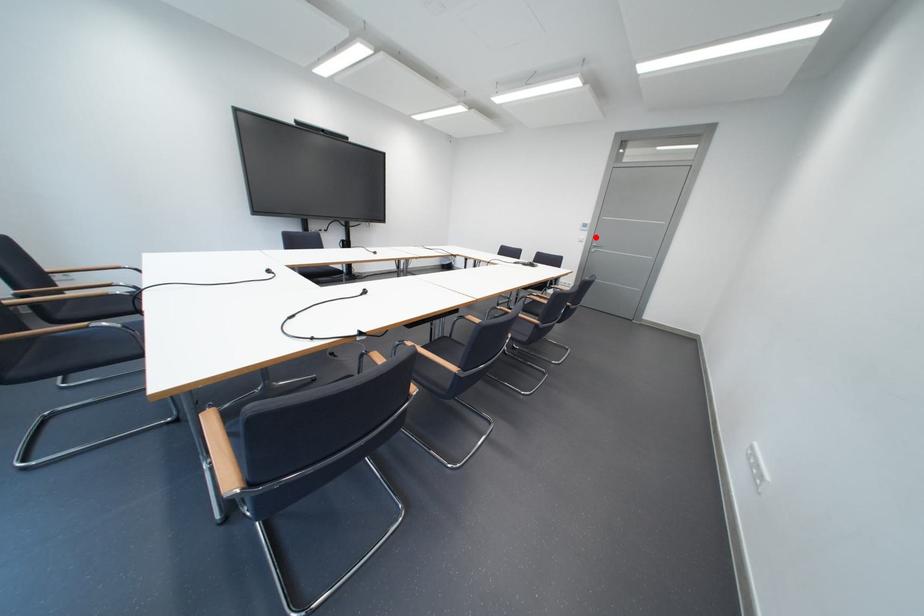
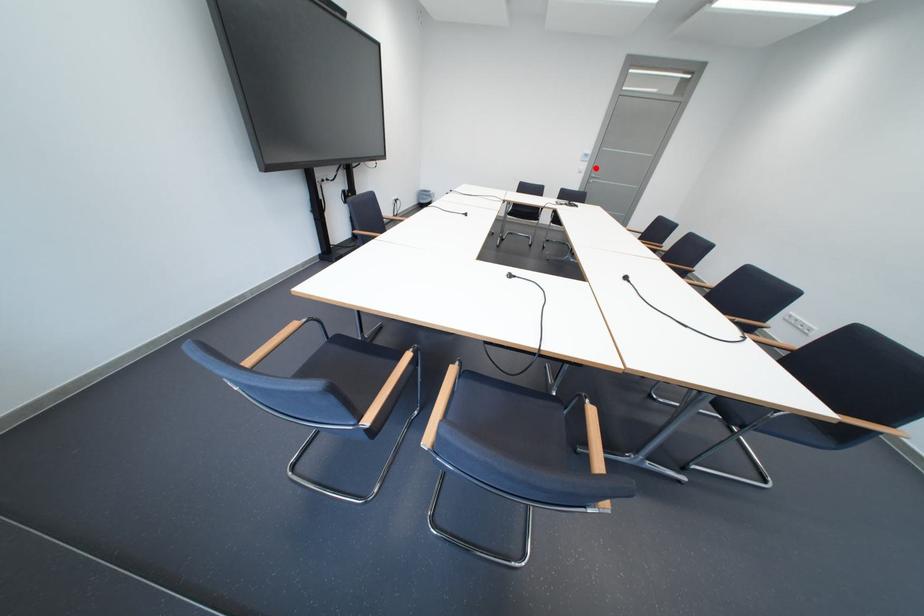
I am providing you with two images of the same scene from different viewpoints. A red point is marked on the first image and another point is marked on the second image. Is the red point in image1 aligned with the point shown in image2?

Yes